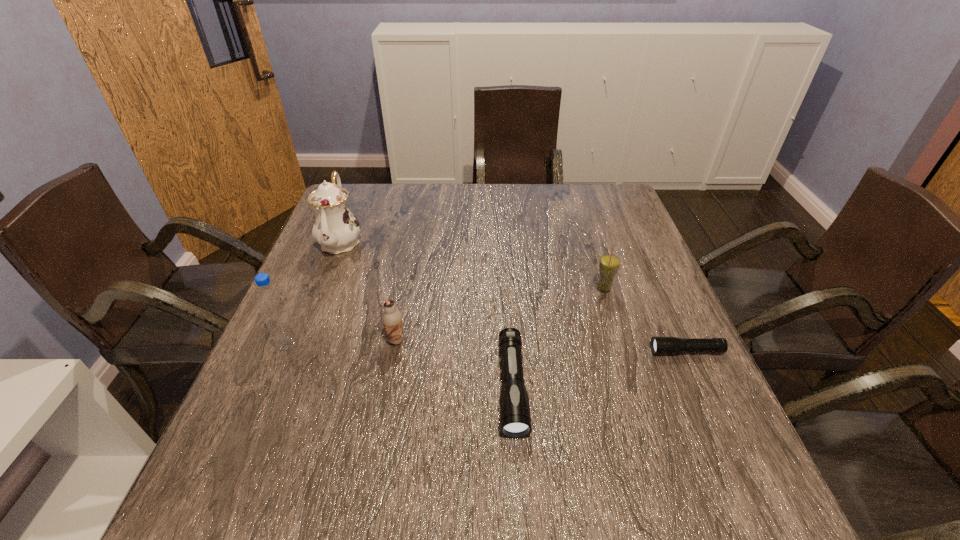
The flashlights are evenly distributed in the image. To maintain this, where would you place another flashlight on the left? Please point to a free space. Please provide its 2D coordinates. Your answer should be formatted as a tuple, i.e. [(x, y)], where the tuple contains the x and y coordinates of a point satisfying the conditions above.

[(309, 428)]